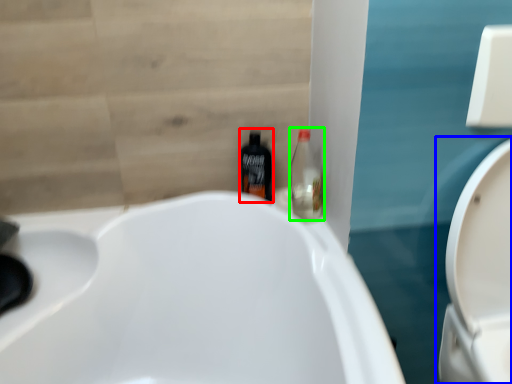
Question: Estimate the real-world distances between objects in this image. Which object is closer to bottle (highlighted by a red box), toilet (highlighted by a blue box) or bottle (highlighted by a green box)?

Choices:
 (A) toilet
 (B) bottle

Answer: (B)